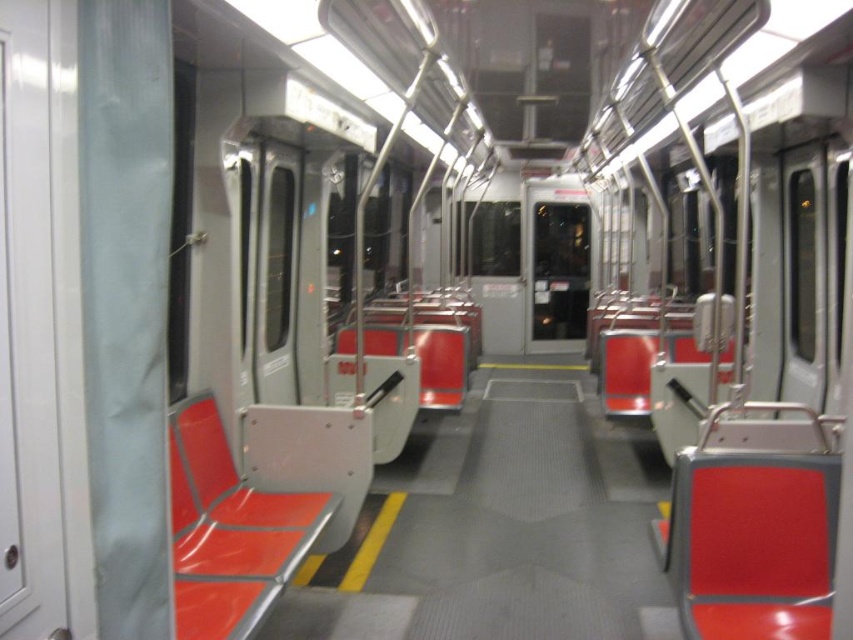
You are a passenger on the train and need to choose between sitting on the matte red seat at center or the metallic red seat at center. Which one offers more seating space?

The matte red seat at center is bigger than the metallic red seat at center, so it offers more seating space.

Based on the photo, you are a passenger on the train and want to know which of the two points, point (746,572) or point (193,528), is closer to you. Based on the image, which one is closer?

Point (746,572) is closer to the camera than point (193,528), so it is closer to you.